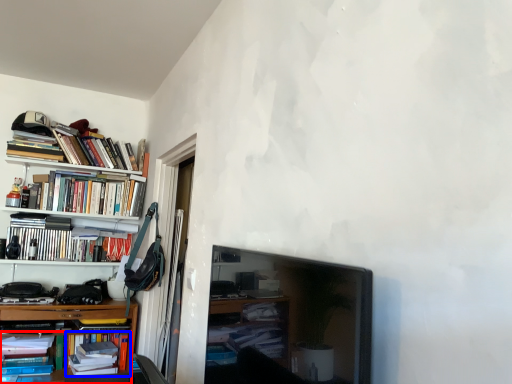
Question: Which object appears closest to the camera in this image, book (highlighted by a red box) or book (highlighted by a blue box)?

Choices:
 (A) book
 (B) book

Answer: (A)